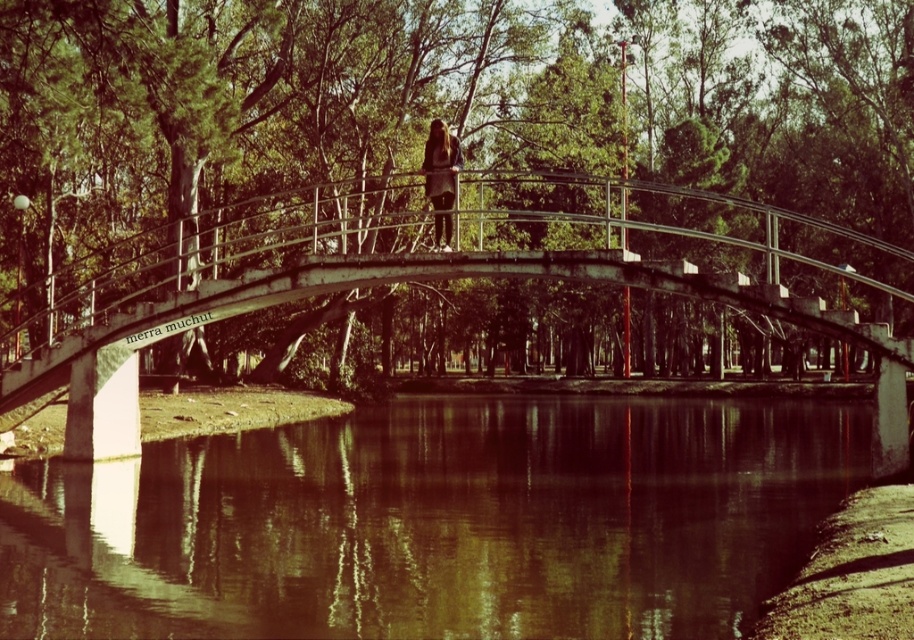
Question: Which point is farther to the camera?

Choices:
 (A) concrete bridge at center
 (B) matte black dress at center

Answer: (B)

Question: Can you confirm if concrete bridge at center is thinner than matte black dress at center?

Choices:
 (A) yes
 (B) no

Answer: (B)

Question: Which is farther from the brown reflective water at center?

Choices:
 (A) matte black dress at center
 (B) concrete bridge at center

Answer: (B)

Question: Does concrete bridge at center appear on the left side of matte black dress at center?

Choices:
 (A) no
 (B) yes

Answer: (A)

Question: Observing the image, what is the correct spatial positioning of brown reflective water at center in reference to matte black dress at center?

Choices:
 (A) below
 (B) above

Answer: (A)

Question: Among these points, which one is nearest to the camera?

Choices:
 (A) (117, 621)
 (B) (449, 209)

Answer: (A)